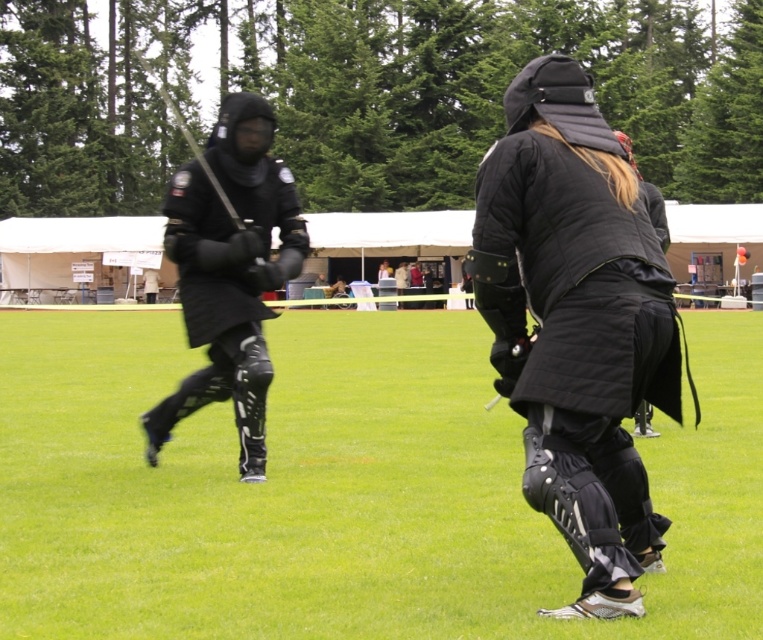
Question: Is the position of black matte knee pads at center less distant than that of matte black armor at left?

Choices:
 (A) no
 (B) yes

Answer: (B)

Question: Which of the following is the closest to the observer?

Choices:
 (A) black matte knee pads at center
 (B) matte black armor at left
 (C) matte black jacket at center

Answer: (A)

Question: Is black matte knee pads at center positioned in front of matte black jacket at center?

Choices:
 (A) yes
 (B) no

Answer: (A)

Question: Among these objects, which one is nearest to the camera?

Choices:
 (A) black matte knee pads at center
 (B) matte black armor at left

Answer: (A)

Question: Can you confirm if black matte knee pads at center is smaller than matte black jacket at center?

Choices:
 (A) yes
 (B) no

Answer: (B)

Question: Among these points, which one is nearest to the camera?

Choices:
 (A) (x=720, y=365)
 (B) (x=427, y=292)
 (C) (x=233, y=220)

Answer: (C)